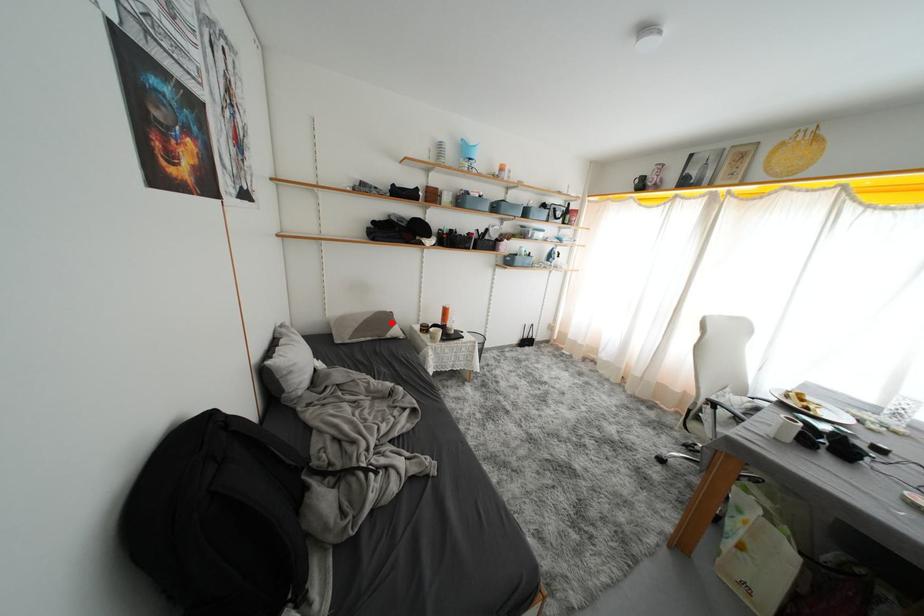
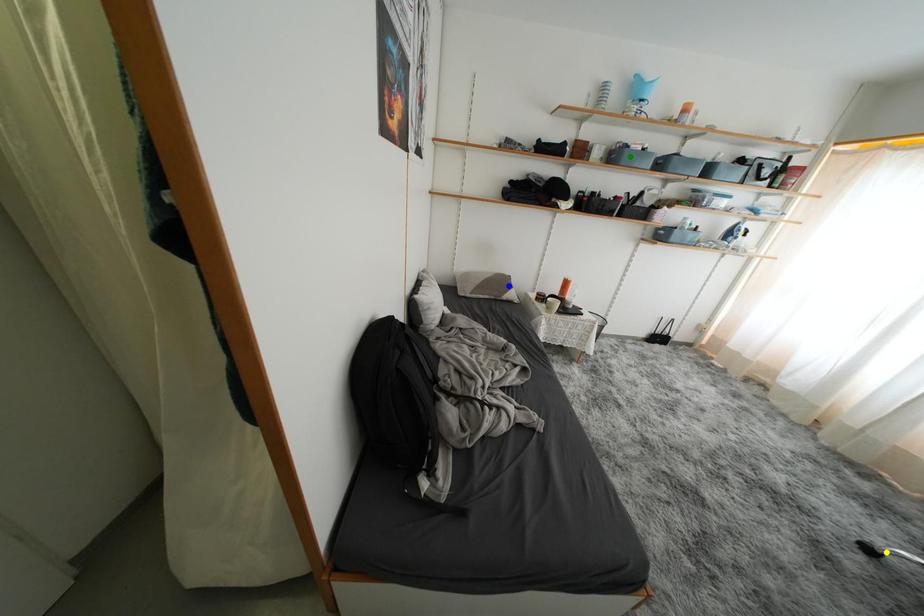
Question: I am providing you with two images of the same scene from different viewpoints. A red point is marked on the first image. You are given multiple points on the second image. Can you choose the point in image 2 that corresponds to the point in image 1?

Choices:
 (A) yellow point
 (B) blue point
 (C) green point

Answer: (B)